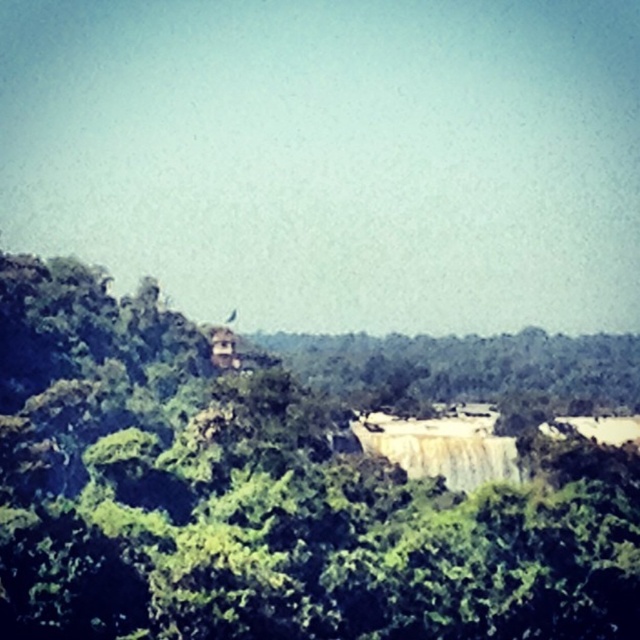
You are standing in the lush landscape and want to take a photo of the green leafy tree at center and the white smooth waterfall at center. Which object should you frame first in your camera to capture both in the same shot?

The green leafy tree at center is positioned on the left side of the white smooth waterfall at center, so you should frame the green leafy tree at center first on the left and then include the white smooth waterfall at center on the right to capture both in the same shot.

Looking at this image, you are standing in the lush landscape described. There is a point labeled at coordinates (x=264, y=499). What object does this point correspond to?

The point at coordinates (x=264, y=499) corresponds to the green leafy tree at center.

You are an environmental scientist assessing the biodiversity of this area. You notice the green leafy tree at center and the white smooth waterfall at center. Which object occupies a wider area in the scene?

The green leafy tree at center has a larger width than the white smooth waterfall at center, so it occupies a wider area in the scene.